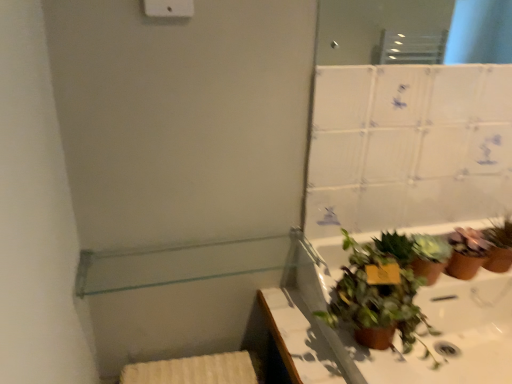
Question: In the image, is green matte plant at lower right, marked as the 2th houseplant in a right-to-left arrangement, on the left side or the right side of brown matte pot at right, the second houseplant viewed from the left?

Choices:
 (A) right
 (B) left

Answer: (B)

Question: From the image's perspective, relative to brown matte pot at right, the first houseplant viewed from the right, is green matte plant at lower right, marked as the 2th houseplant in a right-to-left arrangement, above or below?

Choices:
 (A) above
 (B) below

Answer: (B)

Question: Which object is positioned farthest from the brown matte pot at right, the second houseplant viewed from the left?

Choices:
 (A) green matte plant at lower right, which is the first houseplant from left to right
 (B) brown matte plant pot at lower right
 (C) clear glass shelf at upper left
 (D) white plastic light switch at upper center

Answer: (D)

Question: Considering the real-world distances, which object is closest to the green matte plant at lower right, marked as the 2th houseplant in a right-to-left arrangement?

Choices:
 (A) brown matte plant pot at lower right
 (B) white plastic light switch at upper center
 (C) brown matte pot at right, the first houseplant viewed from the right
 (D) clear glass shelf at upper left

Answer: (C)